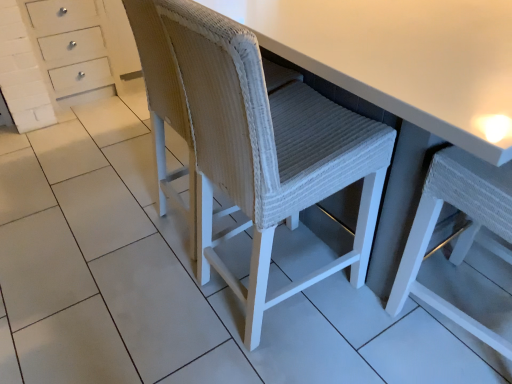
Question: From the image's perspective, is white woven stool at center on top of white woven chair at center, which is the 2th chair from left to right?

Choices:
 (A) no
 (B) yes

Answer: (B)

Question: From a real-world perspective, is white woven stool at center physically above white woven chair at center, which is the 2th chair from left to right?

Choices:
 (A) yes
 (B) no

Answer: (B)

Question: Is white woven chair at center, which ranks as the 1th chair in right-to-left order, at the back of white woven stool at center?

Choices:
 (A) yes
 (B) no

Answer: (B)

Question: From the image's perspective, is white woven stool at center below white woven chair at center, which is the 2th chair from left to right?

Choices:
 (A) no
 (B) yes

Answer: (A)

Question: Does white woven stool at center touch white woven chair at center, which is the 2th chair from left to right?

Choices:
 (A) yes
 (B) no

Answer: (B)

Question: Considering the relative sizes of white woven stool at center and white woven chair at center, which is the 2th chair from left to right, in the image provided, is white woven stool at center taller than white woven chair at center, which is the 2th chair from left to right,?

Choices:
 (A) no
 (B) yes

Answer: (A)

Question: Considering the relative sizes of white woven swivel chair at center and white woven stool at center in the image provided, is white woven swivel chair at center shorter than white woven stool at center?

Choices:
 (A) yes
 (B) no

Answer: (B)

Question: From a real-world perspective, is white woven swivel chair at center below white woven stool at center?

Choices:
 (A) yes
 (B) no

Answer: (B)

Question: Considering the relative sizes of white woven swivel chair at center and white woven stool at center in the image provided, is white woven swivel chair at center thinner than white woven stool at center?

Choices:
 (A) yes
 (B) no

Answer: (A)

Question: Is white woven stool at center surrounded by white woven swivel chair at center?

Choices:
 (A) yes
 (B) no

Answer: (B)

Question: Is the depth of white woven swivel chair at center greater than that of white woven stool at center?

Choices:
 (A) no
 (B) yes

Answer: (B)

Question: Does white woven swivel chair at center touch white woven stool at center?

Choices:
 (A) no
 (B) yes

Answer: (A)

Question: Is the depth of white woven chair at center, the 2th chair viewed from the right, greater than that of white woven stool at center?

Choices:
 (A) yes
 (B) no

Answer: (A)